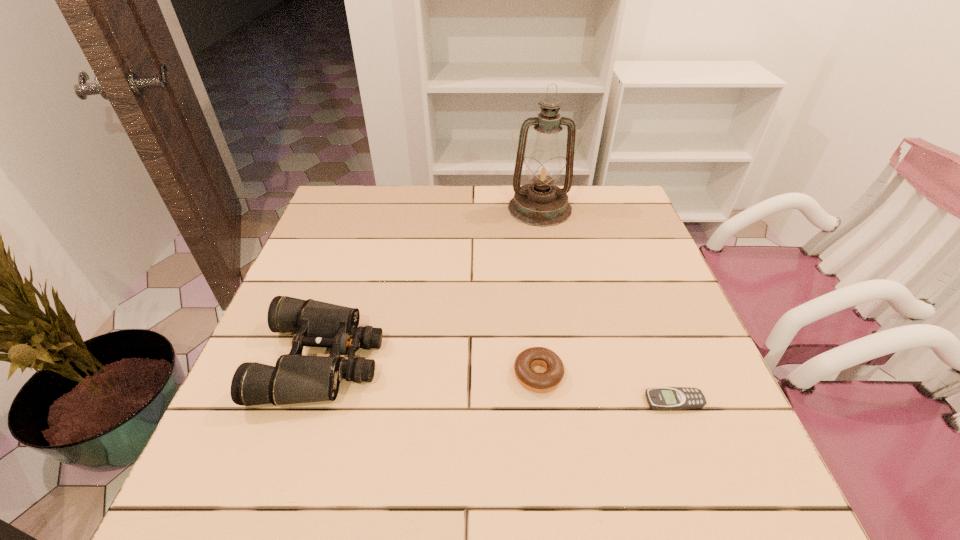
I want to click on free space between the binoculars and the doughnut, so click(x=430, y=367).

What are the coordinates of `vacant area that lies between the doughnut and the leftmost object` in the screenshot? It's located at coord(430,367).

You are a GUI agent. You are given a task and a screenshot of the screen. Output one action in this format:
    pyautogui.click(x=<x>, y=<y>)
    Task: Click on the vacant point located between the tallest object and the rightmost object
    The height and width of the screenshot is (540, 960).
    Given the screenshot: What is the action you would take?
    pyautogui.click(x=607, y=305)

The width and height of the screenshot is (960, 540). What are the coordinates of `unoccupied area between the tallest object and the binoculars` in the screenshot? It's located at (431, 284).

Find the location of `vacant area that lies between the shortest object and the leftmost object`. vacant area that lies between the shortest object and the leftmost object is located at coordinates (498, 380).

Where is `blank region between the rightmost object and the third tallest object`? blank region between the rightmost object and the third tallest object is located at coordinates (606, 388).

What are the coordinates of `vacant area that lies between the second shortest object and the leftmost object` in the screenshot? It's located at (430, 367).

The width and height of the screenshot is (960, 540). In order to click on empty location between the rightmost object and the second tallest object in this screenshot , I will do `click(498, 380)`.

Locate an element on the screen. The height and width of the screenshot is (540, 960). free space that is in between the tallest object and the binoculars is located at coordinates (431, 284).

The height and width of the screenshot is (540, 960). Identify the location of empty location between the tallest object and the second shortest object. (539, 292).